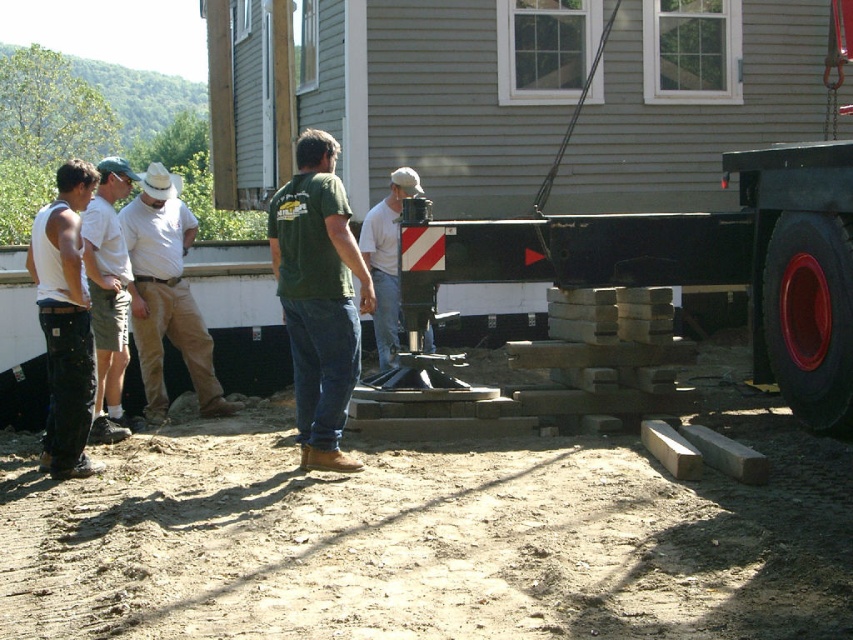
Is denim pants at left positioned before light brown shorts at left?

Yes, denim pants at left is closer to the viewer.

Does denim pants at left have a larger size compared to light brown shorts at left?

No, denim pants at left is not bigger than light brown shorts at left.

The image size is (853, 640). What do you see at coordinates (65, 321) in the screenshot?
I see `denim pants at left` at bounding box center [65, 321].

Find the location of a particular element. The image size is (853, 640). denim pants at left is located at coordinates (65, 321).

Can you confirm if light brown shorts at left is taller than white matte pole at center?

Yes, light brown shorts at left is taller than white matte pole at center.

Which is in front, point (115, 216) or point (392, 172)?

Point (115, 216) is more forward.

The height and width of the screenshot is (640, 853). Identify the location of light brown shorts at left. (108, 296).

I want to click on light brown shorts at left, so click(108, 296).

Does green matte shirt at center appear over khaki cotton pants at center?

Indeed, green matte shirt at center is positioned over khaki cotton pants at center.

Can you confirm if green matte shirt at center is positioned to the left of khaki cotton pants at center?

Incorrect, green matte shirt at center is not on the left side of khaki cotton pants at center.

Who is more forward, (302,260) or (190,381)?

Point (302,260)

This screenshot has width=853, height=640. Identify the location of green matte shirt at center. (318, 298).